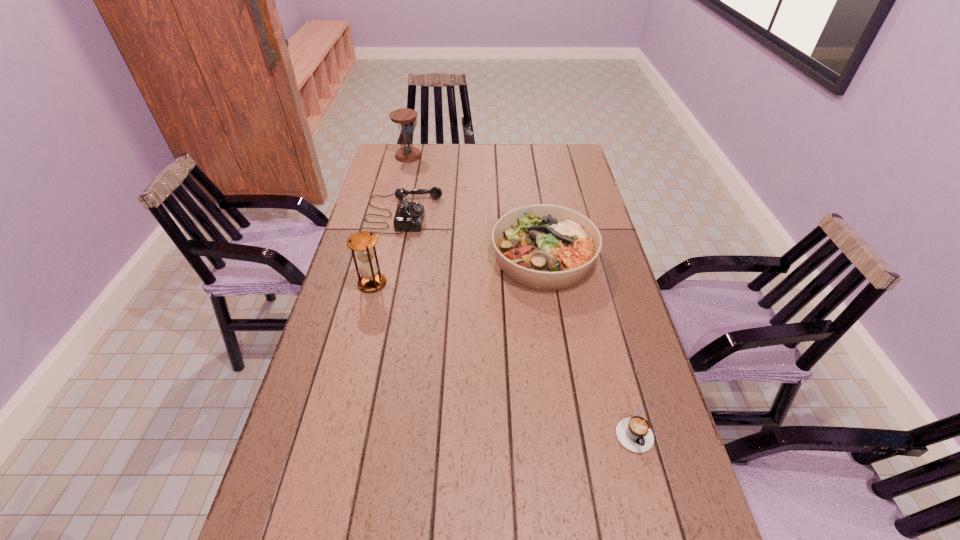
Locate an element on the screen. The height and width of the screenshot is (540, 960). vacant space that's between the nearest object and the telephone is located at coordinates (517, 321).

You are a GUI agent. You are given a task and a screenshot of the screen. Output one action in this format:
    pyautogui.click(x=<x>, y=<y>)
    Task: Click on the free area in between the farthest object and the telephone
    The height and width of the screenshot is (540, 960).
    Given the screenshot: What is the action you would take?
    pyautogui.click(x=406, y=185)

Identify the location of blank region between the farthest object and the nearer hourglass. (391, 220).

At what (x,y) coordinates should I click in order to perform the action: click on free spot between the telephone and the nearer hourglass. Please return your answer as a coordinate pair (x, y). Looking at the image, I should click on (388, 249).

Locate an element on the screen. The image size is (960, 540). empty space between the salad plate and the shortest object is located at coordinates (588, 343).

Image resolution: width=960 pixels, height=540 pixels. Find the location of `empty space between the telephone and the nearer hourglass`. empty space between the telephone and the nearer hourglass is located at coordinates (388, 249).

Where is `free space between the farthest object and the salad plate`? This screenshot has width=960, height=540. free space between the farthest object and the salad plate is located at coordinates (476, 207).

At what (x,y) coordinates should I click in order to perform the action: click on vacant region between the telephone and the salad plate. Please return your answer as a coordinate pair (x, y). This screenshot has width=960, height=540. Looking at the image, I should click on (473, 236).

Identify the location of free space between the nearer hourglass and the shortest object. (502, 356).

I want to click on free space that is in between the salad plate and the nearer hourglass, so click(458, 271).